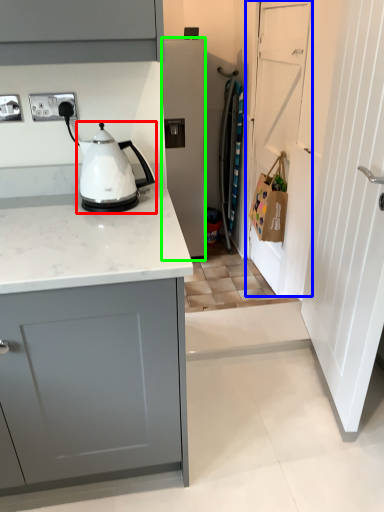
Question: Based on their relative distances, which object is farther from kitchen appliance (highlighted by a red box)? Choose from door (highlighted by a blue box) and home appliance (highlighted by a green box).

Choices:
 (A) door
 (B) home appliance

Answer: (B)